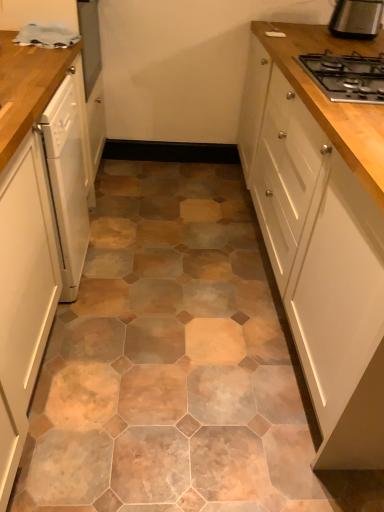
Question: Considering the relative positions of white glossy cabinet at upper right, marked as the first cabinetry in a right-to-left arrangement, and white glossy cabinet at left, the first cabinetry viewed from the left, in the image provided, is white glossy cabinet at upper right, marked as the first cabinetry in a right-to-left arrangement, to the left of white glossy cabinet at left, the first cabinetry viewed from the left, from the viewer's perspective?

Choices:
 (A) yes
 (B) no

Answer: (B)

Question: From the image's perspective, would you say white glossy cabinet at upper right, marked as the first cabinetry in a right-to-left arrangement, is positioned over white glossy cabinet at left, the first cabinetry viewed from the left?

Choices:
 (A) yes
 (B) no

Answer: (A)

Question: Is white glossy cabinet at upper right, which is the 2th cabinetry from left to right, at the right side of white glossy cabinet at left, the first cabinetry viewed from the left?

Choices:
 (A) yes
 (B) no

Answer: (A)

Question: From the image's perspective, is white glossy cabinet at upper right, marked as the first cabinetry in a right-to-left arrangement, located beneath white glossy cabinet at left, the 2th cabinetry positioned from the right?

Choices:
 (A) no
 (B) yes

Answer: (A)

Question: Is white glossy cabinet at upper right, which is the 2th cabinetry from left to right, positioned with its back to white glossy cabinet at left, the 2th cabinetry positioned from the right?

Choices:
 (A) no
 (B) yes

Answer: (A)

Question: Is white glossy cabinet at upper right, which is the 2th cabinetry from left to right, smaller than white glossy cabinet at left, the 2th cabinetry positioned from the right?

Choices:
 (A) yes
 (B) no

Answer: (B)

Question: Is black metallic toaster at upper right oriented away from black metal gas stove at upper right?

Choices:
 (A) yes
 (B) no

Answer: (B)

Question: From the image's perspective, is black metallic toaster at upper right above black metal gas stove at upper right?

Choices:
 (A) yes
 (B) no

Answer: (A)

Question: Is black metal gas stove at upper right inside black metallic toaster at upper right?

Choices:
 (A) no
 (B) yes

Answer: (A)

Question: Is black metallic toaster at upper right in contact with black metal gas stove at upper right?

Choices:
 (A) no
 (B) yes

Answer: (A)

Question: Does black metallic toaster at upper right appear on the right side of black metal gas stove at upper right?

Choices:
 (A) no
 (B) yes

Answer: (B)

Question: Considering the relative sizes of black metallic toaster at upper right and black metal gas stove at upper right in the image provided, is black metallic toaster at upper right bigger than black metal gas stove at upper right?

Choices:
 (A) yes
 (B) no

Answer: (B)

Question: Could you tell me if white glossy cabinet at left, the first cabinetry viewed from the left, is turned towards white glossy cabinet at upper right, marked as the first cabinetry in a right-to-left arrangement?

Choices:
 (A) yes
 (B) no

Answer: (A)